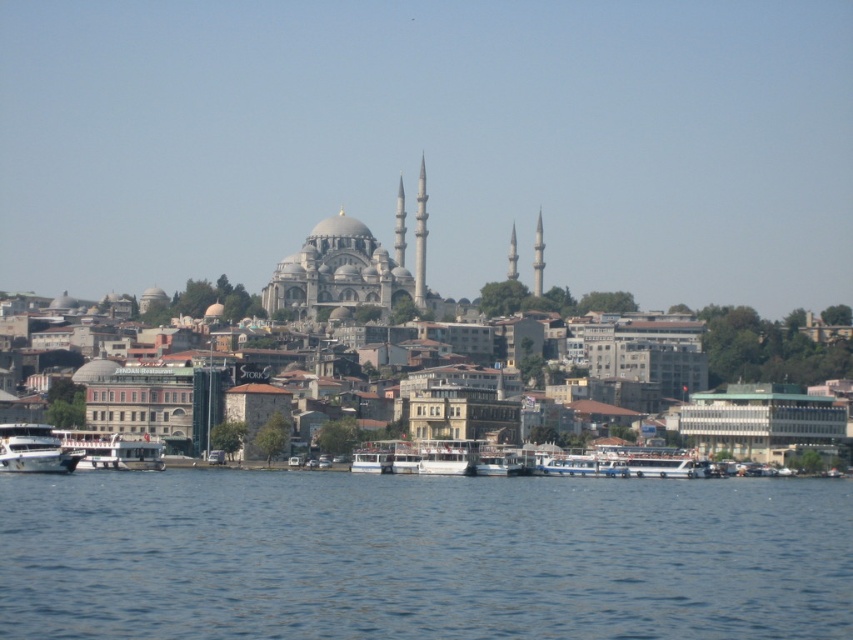
Does white matte boat at lower center appear over white matte boat at lower left?

No.

You are a GUI agent. You are given a task and a screenshot of the screen. Output one action in this format:
    pyautogui.click(x=<x>, y=<y>)
    Task: Click on the white matte boat at lower center
    This screenshot has width=853, height=640.
    Given the screenshot: What is the action you would take?
    (x=109, y=451)

Who is more distant from viewer, (117, 433) or (78, 452)?

The point (117, 433) is more distant.

Where is `white matte boat at lower center`? The width and height of the screenshot is (853, 640). white matte boat at lower center is located at coordinates [x=109, y=451].

Where is `blue water at lower center`? This screenshot has width=853, height=640. blue water at lower center is located at coordinates (421, 556).

Is blue water at lower center behind white matte boat at lower left?

No, blue water at lower center is closer to the viewer.

The image size is (853, 640). I want to click on blue water at lower center, so click(421, 556).

Looking at this image, does white matte boat at lower left lie behind white glossy boat at center?

That is False.

Who is positioned more to the left, white matte boat at lower left or white glossy boat at center?

white matte boat at lower left is more to the left.

Where is `white matte boat at lower left`? white matte boat at lower left is located at coordinates (33, 449).